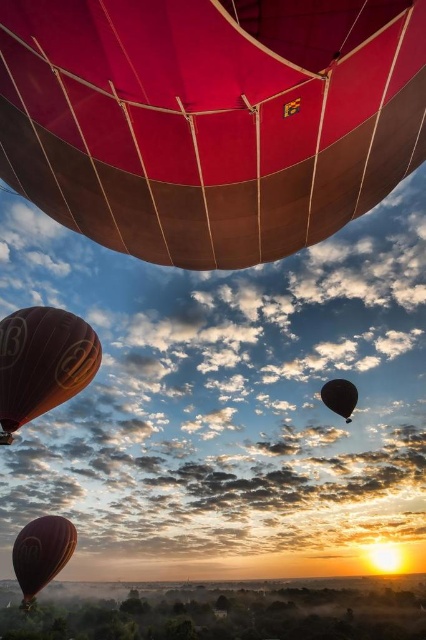
Between point (310, 122) and point (342, 406), which one is positioned in front?

Point (310, 122) is in front.

At what (x,y) coordinates should I click in order to perform the action: click on matte red balloon at upper center. Please return your answer as a coordinate pair (x, y). This screenshot has height=640, width=426. Looking at the image, I should click on (210, 118).

Between point (206, 179) and point (342, 401), which one is positioned behind?

Positioned behind is point (342, 401).

You are a GUI agent. You are given a task and a screenshot of the screen. Output one action in this format:
    pyautogui.click(x=<x>, y=<y>)
    Task: Click on the matte red balloon at upper center
    
    Given the screenshot: What is the action you would take?
    click(210, 118)

Which is behind, point (20, 403) or point (350, 390)?

The point (350, 390) is behind.

Can you confirm if matte orange balloon at lower left is positioned to the left of black glossy balloon at lower right?

Correct, you'll find matte orange balloon at lower left to the left of black glossy balloon at lower right.

The width and height of the screenshot is (426, 640). What are the coordinates of `matte orange balloon at lower left` in the screenshot? It's located at (43, 364).

Consider the image. Does matte orange balloon at lower left appear over matte brown hot air balloon at lower left?

Yes, matte orange balloon at lower left is above matte brown hot air balloon at lower left.

Does point (63, 358) lie in front of point (28, 572)?

Yes, point (63, 358) is closer to viewer.

The height and width of the screenshot is (640, 426). I want to click on matte orange balloon at lower left, so (43, 364).